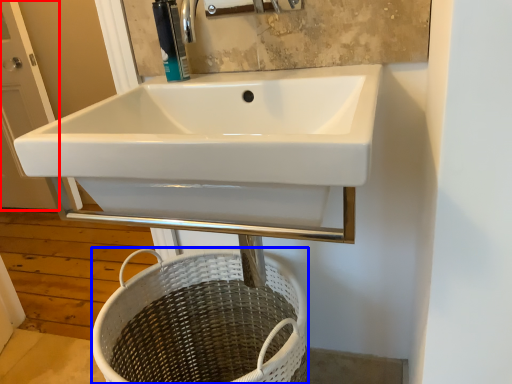
Question: Which of the following is the closest to the observer, screen door (highlighted by a red box) or basket (highlighted by a blue box)?

Choices:
 (A) screen door
 (B) basket

Answer: (B)